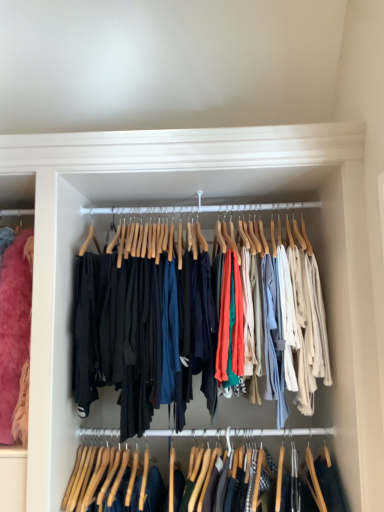
Question: Considering the positions of matte black pants at center, the 2th closet from the bottom, and denim jeans at center, acting as the 1th closet starting from the bottom, in the image, is matte black pants at center, the 2th closet from the bottom, taller or shorter than denim jeans at center, acting as the 1th closet starting from the bottom,?

Choices:
 (A) tall
 (B) short

Answer: (A)

Question: From a real-world perspective, is matte black pants at center, which appears as the first closet when viewed from the top, above or below denim jeans at center, acting as the 1th closet starting from the bottom?

Choices:
 (A) above
 (B) below

Answer: (A)

Question: Considering the relative positions of matte black pants at center, the 2th closet from the bottom, and denim jeans at center, acting as the 1th closet starting from the bottom, in the image provided, is matte black pants at center, the 2th closet from the bottom, to the left or to the right of denim jeans at center, acting as the 1th closet starting from the bottom,?

Choices:
 (A) right
 (B) left

Answer: (B)

Question: Looking at their shapes, would you say denim jeans at center, the 2th closet from the top, is wider or thinner than matte black pants at center, the 2th closet from the bottom?

Choices:
 (A) wide
 (B) thin

Answer: (B)

Question: Considering the positions of denim jeans at center, acting as the 1th closet starting from the bottom, and matte black pants at center, the 2th closet from the bottom, in the image, is denim jeans at center, acting as the 1th closet starting from the bottom, bigger or smaller than matte black pants at center, the 2th closet from the bottom,?

Choices:
 (A) small
 (B) big

Answer: (A)

Question: From a real-world perspective, is denim jeans at center, the 2th closet from the top, above or below matte black pants at center, which appears as the first closet when viewed from the top?

Choices:
 (A) below
 (B) above

Answer: (A)

Question: Is denim jeans at center, the 2th closet from the top, inside the boundaries of matte black pants at center, the 2th closet from the bottom, or outside?

Choices:
 (A) outside
 (B) inside

Answer: (A)